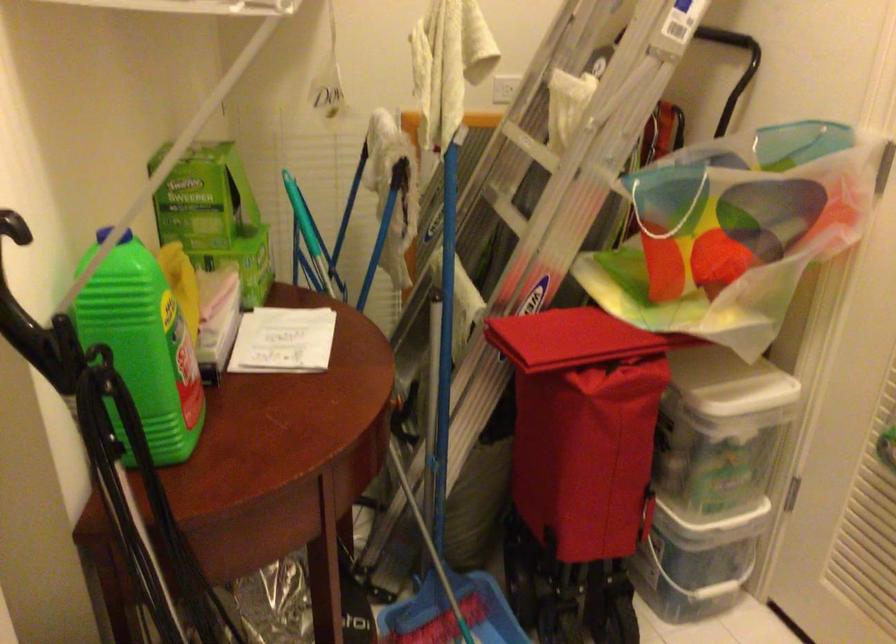
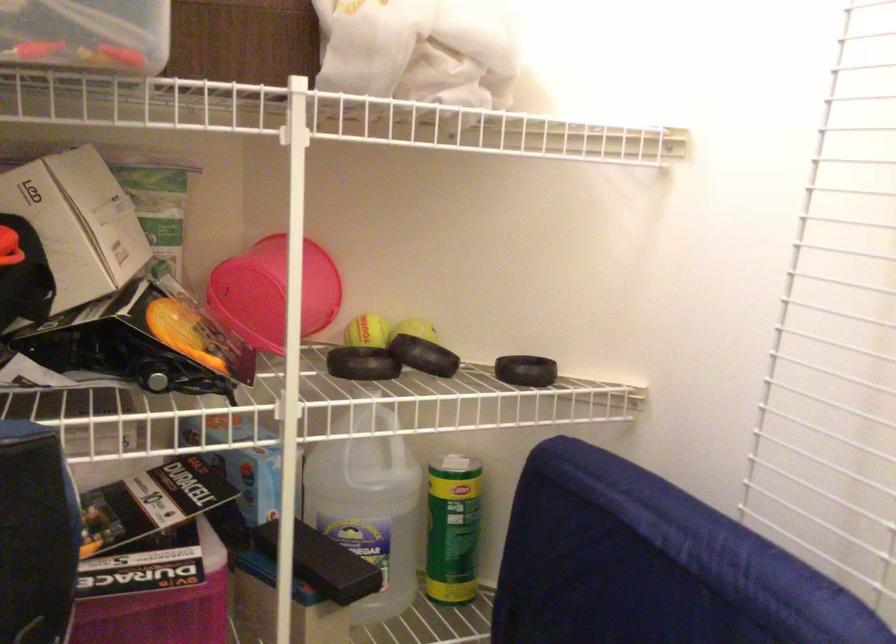
Question: How did the camera likely rotate?

Choices:
 (A) Left
 (B) Right
 (C) Up
 (D) Down

Answer: (A)